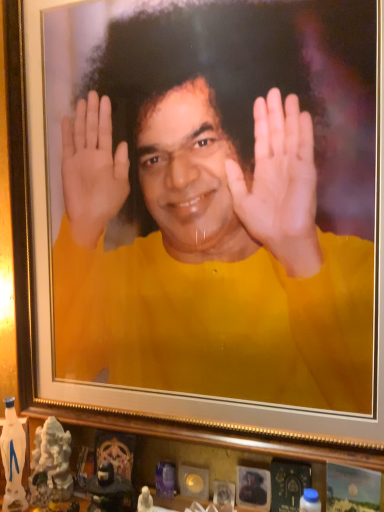
What is the approximate width of yellow matte shirt at center?

yellow matte shirt at center is 3.76 centimeters wide.

At what (x,y) coordinates should I click in order to perform the action: click on white glossy statue at lower left, which ranks as the 1th toy in left-to-right order. Please return your answer as a coordinate pair (x, y). The width and height of the screenshot is (384, 512). Looking at the image, I should click on (51, 464).

Between yellow matte shirt at center and matte black statue at lower center, marked as the 2th toy in a left-to-right arrangement, which one is positioned behind?

Positioned behind is matte black statue at lower center, marked as the 2th toy in a left-to-right arrangement.

Can you confirm if yellow matte shirt at center is wider than matte black statue at lower center, marked as the 1th toy in a right-to-left arrangement?

In fact, yellow matte shirt at center might be narrower than matte black statue at lower center, marked as the 1th toy in a right-to-left arrangement.

Is matte black statue at lower center, marked as the 1th toy in a right-to-left arrangement, inside yellow matte shirt at center?

No.

From a real-world perspective, between yellow matte shirt at center and matte black statue at lower center, marked as the 2th toy in a left-to-right arrangement, who is vertically higher?

In real-world perspective, yellow matte shirt at center is above.

There is a matte black statue at lower center, marked as the 1th toy in a right-to-left arrangement. Where is `man above it (from a real-world perspective)`? The height and width of the screenshot is (512, 384). man above it (from a real-world perspective) is located at coordinates (220, 205).

Does point (98, 499) appear closer or farther from the camera than point (172, 37)?

Clearly, point (98, 499) is more distant from the camera than point (172, 37).

From a real-world perspective, is matte black statue at lower center, marked as the 1th toy in a right-to-left arrangement, on yellow matte shirt at center?

No, from a real-world perspective, matte black statue at lower center, marked as the 1th toy in a right-to-left arrangement, is not above yellow matte shirt at center.

Based on their positions, is matte black statue at lower center, marked as the 2th toy in a left-to-right arrangement, located to the left or right of yellow matte shirt at center?

In the image, matte black statue at lower center, marked as the 2th toy in a left-to-right arrangement, appears on the left side of yellow matte shirt at center.

From a real-world perspective, which object stands above the other?

In real-world perspective, yellow matte shirt at center is above.

Are yellow matte shirt at center and white glossy statue at lower left, acting as the 2th toy starting from the right, located far from each other?

No, yellow matte shirt at center is not far away from white glossy statue at lower left, acting as the 2th toy starting from the right.

Consider the image. Between yellow matte shirt at center and white glossy statue at lower left, acting as the 2th toy starting from the right, which one has smaller size?

white glossy statue at lower left, acting as the 2th toy starting from the right, is smaller.

From the image's perspective, is white glossy statue at lower left, acting as the 2th toy starting from the right, positioned above or below yellow matte shirt at center?

From the image's perspective, white glossy statue at lower left, acting as the 2th toy starting from the right, appears below yellow matte shirt at center.

Is white glossy statue at lower left, acting as the 2th toy starting from the right, situated inside yellow matte shirt at center or outside?

white glossy statue at lower left, acting as the 2th toy starting from the right, exists outside the volume of yellow matte shirt at center.

Looking at the image, does white glossy statue at lower left, which ranks as the 1th toy in left-to-right order, seem bigger or smaller compared to yellow matte shirt at center?

In the image, white glossy statue at lower left, which ranks as the 1th toy in left-to-right order, appears to be smaller than yellow matte shirt at center.

Can you confirm if white glossy statue at lower left, which ranks as the 1th toy in left-to-right order, is thinner than yellow matte shirt at center?

No.

Is white glossy statue at lower left, acting as the 2th toy starting from the right, at the back of matte black statue at lower center, marked as the 1th toy in a right-to-left arrangement?

No, matte black statue at lower center, marked as the 1th toy in a right-to-left arrangement, is not facing the opposite direction of white glossy statue at lower left, acting as the 2th toy starting from the right.

Between matte black statue at lower center, marked as the 1th toy in a right-to-left arrangement, and white glossy statue at lower left, which ranks as the 1th toy in left-to-right order, which one has more height?

white glossy statue at lower left, which ranks as the 1th toy in left-to-right order.

From the image's perspective, would you say matte black statue at lower center, marked as the 1th toy in a right-to-left arrangement, is shown under white glossy statue at lower left, acting as the 2th toy starting from the right?

Yes, from the image's perspective, matte black statue at lower center, marked as the 1th toy in a right-to-left arrangement, is beneath white glossy statue at lower left, acting as the 2th toy starting from the right.

Between white glossy statue at lower left, acting as the 2th toy starting from the right, and matte black statue at lower center, marked as the 2th toy in a left-to-right arrangement, which one has larger size?

white glossy statue at lower left, acting as the 2th toy starting from the right.

Is white glossy statue at lower left, which ranks as the 1th toy in left-to-right order, in contact with matte black statue at lower center, marked as the 2th toy in a left-to-right arrangement?

No, white glossy statue at lower left, which ranks as the 1th toy in left-to-right order, is not touching matte black statue at lower center, marked as the 2th toy in a left-to-right arrangement.

How different are the orientations of white glossy statue at lower left, acting as the 2th toy starting from the right, and matte black statue at lower center, marked as the 1th toy in a right-to-left arrangement, in degrees?

They differ by 7.14 degrees in their facing directions.

How much distance is there between white glossy statue at lower left, acting as the 2th toy starting from the right, and matte black statue at lower center, marked as the 1th toy in a right-to-left arrangement?

They are 4.49 inches apart.

Locate an element on the screen. This screenshot has width=384, height=512. the 2nd toy positioned below the yellow matte shirt at center (from a real-world perspective) is located at coordinates (110, 490).

Locate an element on the screen. This screenshot has height=512, width=384. man above the matte black statue at lower center, marked as the 1th toy in a right-to-left arrangement (from a real-world perspective) is located at coordinates (220, 205).

Which object lies further to the anchor point white glossy statue at lower left, acting as the 2th toy starting from the right, yellow matte shirt at center or matte black statue at lower center, marked as the 1th toy in a right-to-left arrangement?

yellow matte shirt at center lies further to white glossy statue at lower left, acting as the 2th toy starting from the right, than the other object.

Estimate the real-world distances between objects in this image. Which object is closer to yellow matte shirt at center, white glossy statue at lower left, acting as the 2th toy starting from the right, or matte black statue at lower center, marked as the 1th toy in a right-to-left arrangement?

The object closer to yellow matte shirt at center is white glossy statue at lower left, acting as the 2th toy starting from the right.

Based on their spatial positions, is yellow matte shirt at center or white glossy statue at lower left, acting as the 2th toy starting from the right, further from matte black statue at lower center, marked as the 2th toy in a left-to-right arrangement?

yellow matte shirt at center lies further to matte black statue at lower center, marked as the 2th toy in a left-to-right arrangement, than the other object.

Looking at the image, which one is located closer to yellow matte shirt at center, matte black statue at lower center, marked as the 2th toy in a left-to-right arrangement, or white glossy statue at lower left, which ranks as the 1th toy in left-to-right order?

Among the two, white glossy statue at lower left, which ranks as the 1th toy in left-to-right order, is located nearer to yellow matte shirt at center.

Looking at the image, which one is located further to white glossy statue at lower left, which ranks as the 1th toy in left-to-right order, matte black statue at lower center, marked as the 1th toy in a right-to-left arrangement, or yellow matte shirt at center?

yellow matte shirt at center.

Consider the image. Based on their spatial positions, is white glossy statue at lower left, acting as the 2th toy starting from the right, or yellow matte shirt at center further from matte black statue at lower center, marked as the 2th toy in a left-to-right arrangement?

Based on the image, yellow matte shirt at center appears to be further to matte black statue at lower center, marked as the 2th toy in a left-to-right arrangement.

This screenshot has height=512, width=384. In order to click on toy between yellow matte shirt at center and matte black statue at lower center, marked as the 1th toy in a right-to-left arrangement, from top to bottom in this screenshot , I will do `click(51, 464)`.